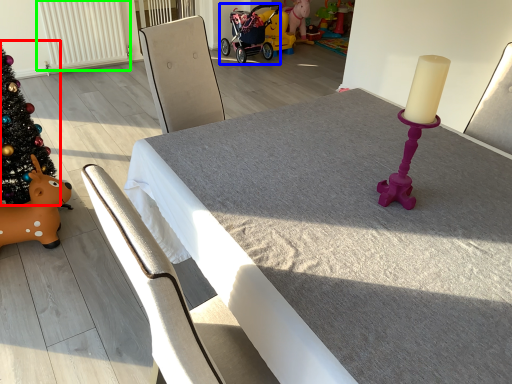
Question: Estimate the real-world distances between objects in this image. Which object is closer to christmas tree (highlighted by a red box), baby carriage (highlighted by a blue box) or radiator (highlighted by a green box)?

Choices:
 (A) baby carriage
 (B) radiator

Answer: (B)